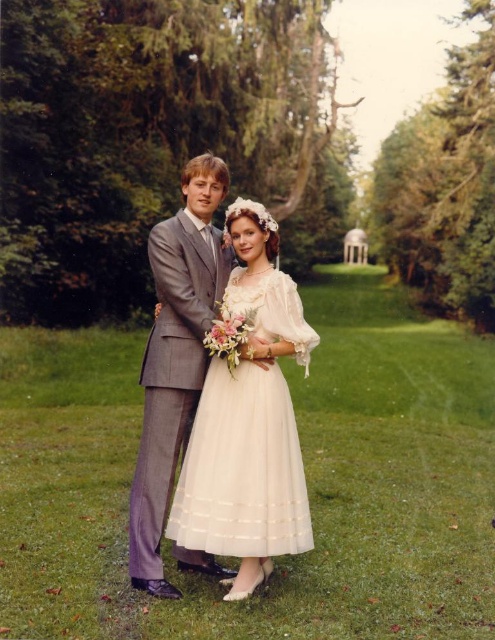
Question: In this image, where is sheer white dress at center located relative to gray textured suit at center?

Choices:
 (A) right
 (B) left

Answer: (A)

Question: Is sheer white dress at center positioned before gray textured suit at center?

Choices:
 (A) no
 (B) yes

Answer: (B)

Question: Which point is closer to the camera taking this photo?

Choices:
 (A) (182, 323)
 (B) (235, 508)

Answer: (B)

Question: Which object appears farthest from the camera in this image?

Choices:
 (A) gray textured suit at center
 (B) sheer white dress at center

Answer: (A)

Question: Can you confirm if sheer white dress at center is positioned above gray textured suit at center?

Choices:
 (A) yes
 (B) no

Answer: (B)